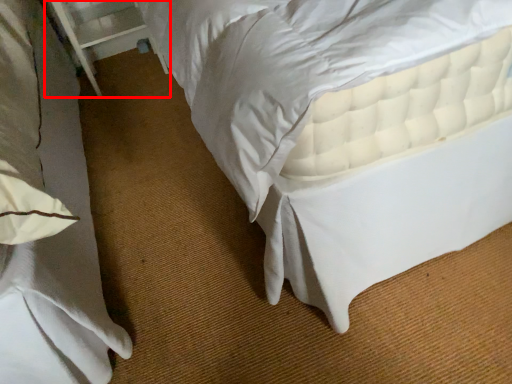
Question: From the image, what is the correct spatial relationship of balustrade (annotated by the red box) in relation to bed?

Choices:
 (A) right
 (B) left

Answer: (B)